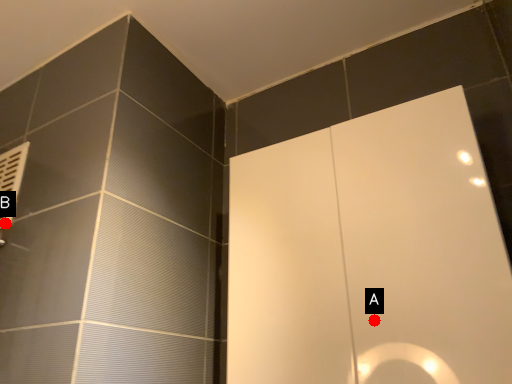
Question: Two points are circled on the image, labeled by A and B beside each circle. Which point is closer to the camera?

Choices:
 (A) A is closer
 (B) B is closer

Answer: (A)